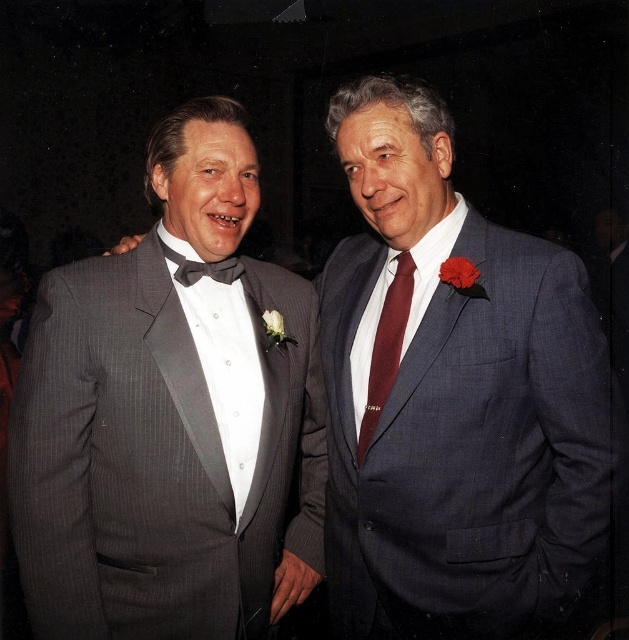
Looking at this image, is matte gray tuxedo at left below dark blue textured suit at right?

Actually, matte gray tuxedo at left is above dark blue textured suit at right.

Find the location of `matte gray tuxedo at left`. matte gray tuxedo at left is located at coordinates pyautogui.click(x=457, y=397).

Is point (223, 461) less distant than point (398, 336)?

Yes.

Is gray pinstripe tuxedo at left below maroon silk tie at center?

Indeed, gray pinstripe tuxedo at left is positioned under maroon silk tie at center.

Which is behind, point (91, 328) or point (391, 305)?

Positioned behind is point (391, 305).

In order to click on gray pinstripe tuxedo at left in this screenshot , I will do `click(155, 458)`.

Which is above, dark blue textured suit at right or gray pinstripe tuxedo at left?

gray pinstripe tuxedo at left is above.

Identify the location of dark blue textured suit at right. Image resolution: width=629 pixels, height=640 pixels. (467, 440).